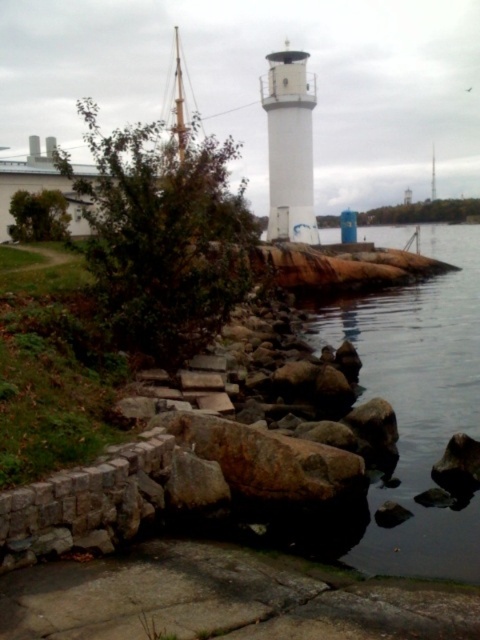
Question: Among these points, which one is farthest from the camera?

Choices:
 (A) (445, 384)
 (B) (305, 120)

Answer: (B)

Question: Which of the following is the closest to the observer?

Choices:
 (A) white smooth lighthouse at center
 (B) rockyrough stonerocks at lower center

Answer: (B)

Question: Can you confirm if rockyrough stonerocks at lower center is positioned to the right of smooth rock lake at center?

Choices:
 (A) yes
 (B) no

Answer: (B)

Question: Can you confirm if rockyrough stonerocks at lower center is positioned to the left of smooth rock lake at center?

Choices:
 (A) yes
 (B) no

Answer: (A)

Question: Which object is the closest to the smooth rock lake at center?

Choices:
 (A) white smooth lighthouse at center
 (B) rockyrough stonerocks at lower center

Answer: (B)

Question: Does rockyrough stonerocks at lower center appear on the right side of smooth rock lake at center?

Choices:
 (A) yes
 (B) no

Answer: (B)